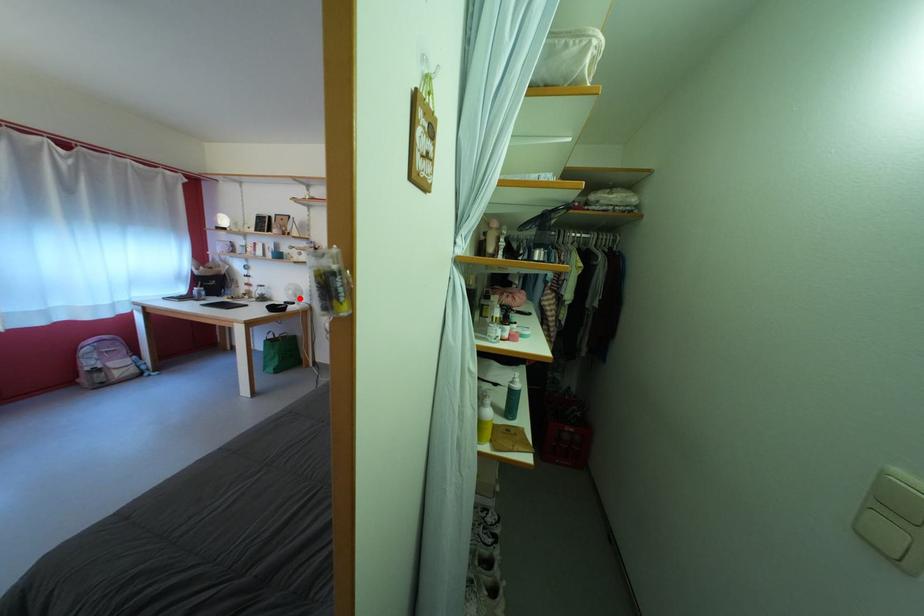
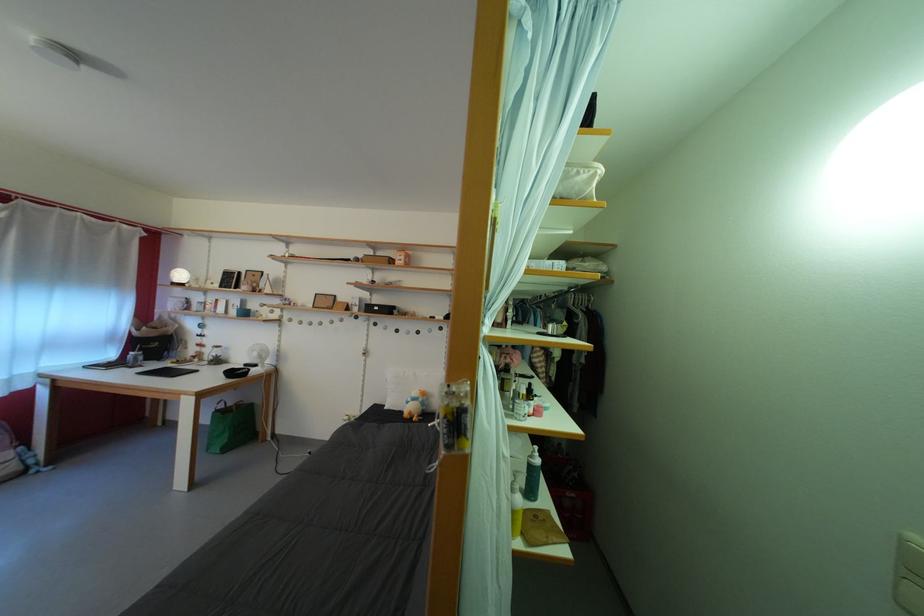
Question: A red point is marked in image1. In image2, is the corresponding 3D point closer to the camera or farther? Reply with the corresponding letter.

Choices:
 (A) The corresponding 3D point is closer.
 (B) The corresponding 3D point is farther.

Answer: (A)